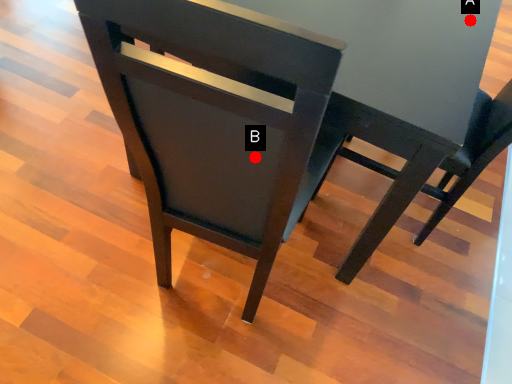
Question: Two points are circled on the image, labeled by A and B beside each circle. Which point appears closest to the camera in this image?

Choices:
 (A) A is closer
 (B) B is closer

Answer: (B)